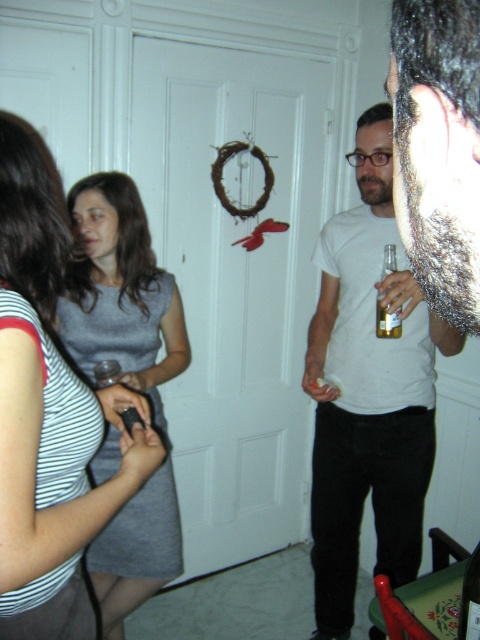
Question: Based on their relative distances, which object is nearer to the gray matte dress at center?

Choices:
 (A) white matte t-shirt at center
 (B) clear glass bottle at center

Answer: (A)

Question: Which object is farther from the camera taking this photo?

Choices:
 (A) clear glass bottle at center
 (B) white matte t-shirt at center
 (C) gray matte dress at center

Answer: (C)

Question: Considering the relative positions of white matte t-shirt at center and gray matte dress at center in the image provided, where is white matte t-shirt at center located with respect to gray matte dress at center?

Choices:
 (A) below
 (B) above

Answer: (B)

Question: Does gray matte dress at center appear under clear glass bottle at center?

Choices:
 (A) no
 (B) yes

Answer: (B)

Question: Is white matte t-shirt at center smaller than clear glass bottle at center?

Choices:
 (A) no
 (B) yes

Answer: (A)

Question: Which of these objects is positioned closest to the clear glass bottle at center?

Choices:
 (A) gray matte dress at center
 (B) white matte t-shirt at center

Answer: (B)